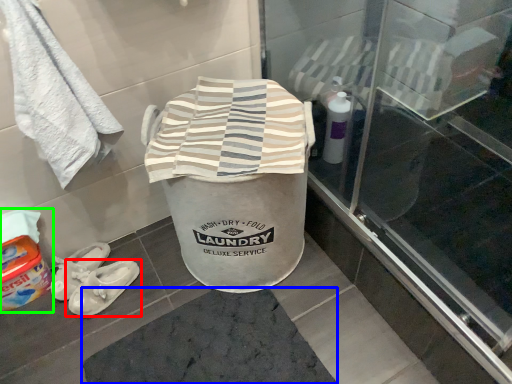
Question: Estimate the real-world distances between objects in this image. Which object is farther from footwear (highlighted by a red box), bath mat (highlighted by a blue box) or wash (highlighted by a green box)?

Choices:
 (A) bath mat
 (B) wash

Answer: (A)